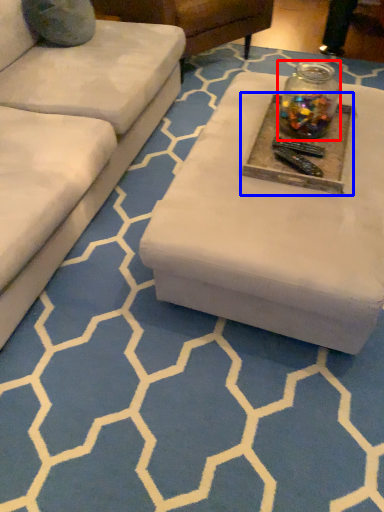
Question: Which object is closer to the camera taking this photo, glass jar (highlighted by a red box) or round table (highlighted by a blue box)?

Choices:
 (A) glass jar
 (B) round table

Answer: (B)